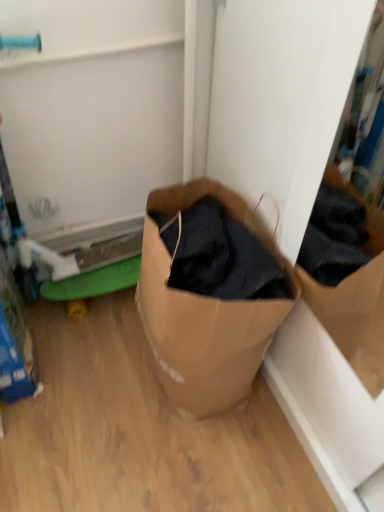
Locate an element on the screen. The image size is (384, 512). blank space situated above green rubber toy at lower left (from a real-world perspective) is located at coordinates (90, 280).